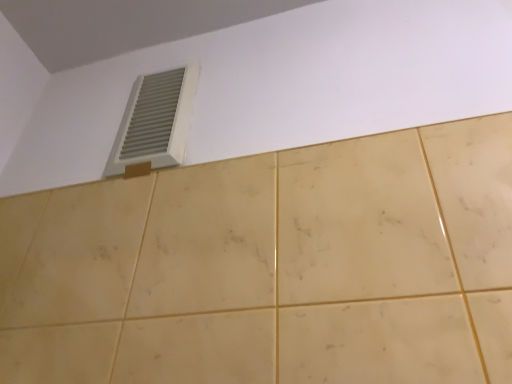
What is the approximate width of white plastic vent at upper left?

The width of white plastic vent at upper left is 1.31 inches.

Describe the element at coordinates (155, 120) in the screenshot. This screenshot has width=512, height=384. I see `white plastic vent at upper left` at that location.

The width and height of the screenshot is (512, 384). In order to click on white plastic vent at upper left in this screenshot , I will do `click(155, 120)`.

Find the location of `white plastic vent at upper left`. white plastic vent at upper left is located at coordinates (155, 120).